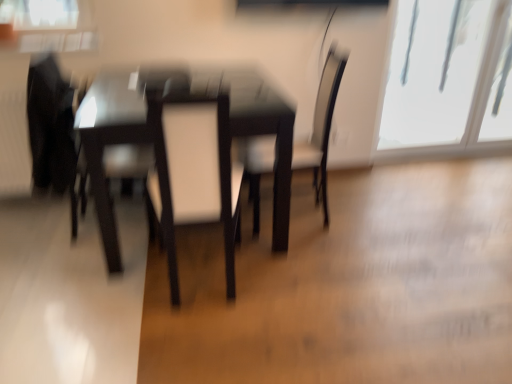
Question: Is glossy dark wood table at center to the left of transparent glass window at upper right from the viewer's perspective?

Choices:
 (A) yes
 (B) no

Answer: (A)

Question: Is glossy dark wood table at center outside of transparent glass window at upper right?

Choices:
 (A) yes
 (B) no

Answer: (A)

Question: Considering the relative sizes of glossy dark wood table at center and transparent glass window at upper right in the image provided, is glossy dark wood table at center wider than transparent glass window at upper right?

Choices:
 (A) yes
 (B) no

Answer: (A)

Question: Does glossy dark wood table at center touch transparent glass window at upper right?

Choices:
 (A) no
 (B) yes

Answer: (A)

Question: Does glossy dark wood table at center have a greater height compared to transparent glass window at upper right?

Choices:
 (A) yes
 (B) no

Answer: (B)

Question: Is point (105, 129) closer or farther from the camera than point (386, 102)?

Choices:
 (A) farther
 (B) closer

Answer: (B)

Question: Is glossy dark wood table at center situated inside transparent glass window at upper right or outside?

Choices:
 (A) inside
 (B) outside

Answer: (B)

Question: Considering the positions of glossy dark wood table at center and transparent glass window at upper right in the image, is glossy dark wood table at center bigger or smaller than transparent glass window at upper right?

Choices:
 (A) big
 (B) small

Answer: (A)

Question: From the image's perspective, relative to transparent glass window at upper right, is glossy dark wood table at center above or below?

Choices:
 (A) above
 (B) below

Answer: (B)

Question: Based on their positions, is white leather swivel chair at center, arranged as the first swivel chair when viewed from the right, located to the left or right of transparent glass window at upper right?

Choices:
 (A) left
 (B) right

Answer: (A)

Question: In terms of height, does white leather swivel chair at center, marked as the 2th swivel chair in a left-to-right arrangement, look taller or shorter compared to transparent glass window at upper right?

Choices:
 (A) short
 (B) tall

Answer: (A)

Question: In terms of size, does white leather swivel chair at center, marked as the 2th swivel chair in a left-to-right arrangement, appear bigger or smaller than transparent glass window at upper right?

Choices:
 (A) big
 (B) small

Answer: (B)

Question: From the image's perspective, is white leather swivel chair at center, arranged as the first swivel chair when viewed from the right, above or below transparent glass window at upper right?

Choices:
 (A) above
 (B) below

Answer: (B)

Question: In terms of width, does white leather swivel chair at center, arranged as the first swivel chair when viewed from the right, look wider or thinner when compared to matte black swivel chair at left, which is the 1th swivel chair from left to right?

Choices:
 (A) thin
 (B) wide

Answer: (B)

Question: From a real-world perspective, relative to matte black swivel chair at left, which is the 1th swivel chair from left to right, is white leather swivel chair at center, arranged as the first swivel chair when viewed from the right, vertically above or below?

Choices:
 (A) above
 (B) below

Answer: (B)